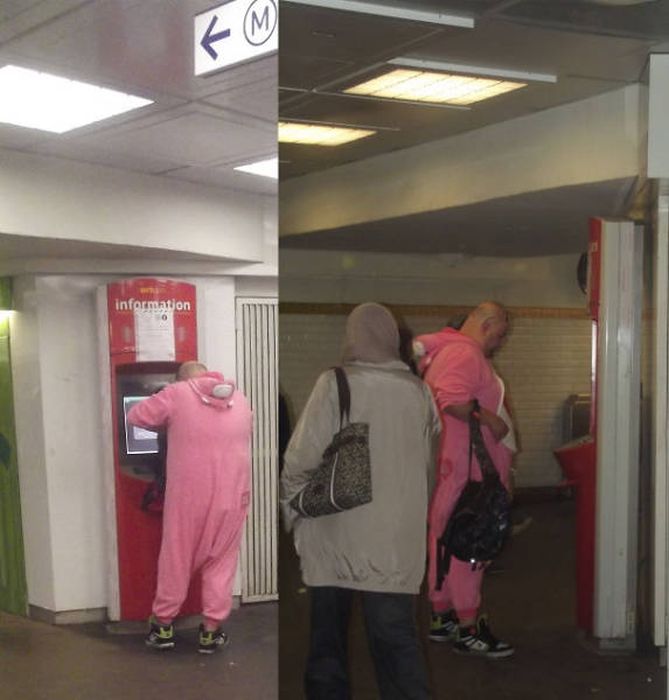
You are a GUI agent. You are given a task and a screenshot of the screen. Output one action in this format:
    pyautogui.click(x=<x>, y=<y>)
    Task: Click on the wall
    This screenshot has width=669, height=700.
    Given the screenshot: What is the action you would take?
    pyautogui.click(x=537, y=364)